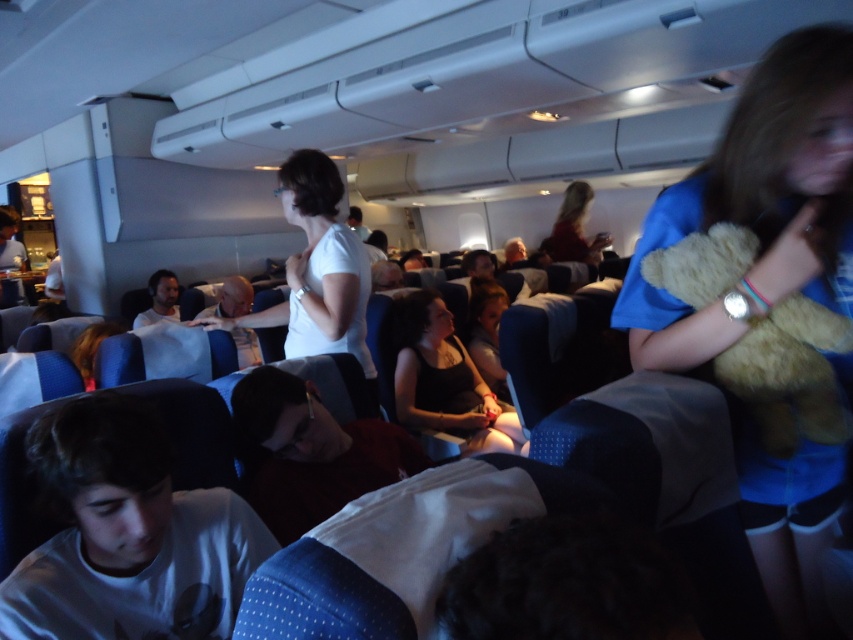
Question: Can you confirm if fluffy beige teddy bear at right is positioned below fuzzy beige teddy bear at right?

Choices:
 (A) yes
 (B) no

Answer: (A)

Question: Does fluffy beige teddy bear at right lie in front of fuzzy beige teddy bear at right?

Choices:
 (A) yes
 (B) no

Answer: (A)

Question: Which object appears closest to the camera in this image?

Choices:
 (A) fuzzy beige teddy bear at right
 (B) fluffy beige teddy bear at right

Answer: (B)

Question: Is fluffy beige teddy bear at right smaller than fuzzy beige teddy bear at right?

Choices:
 (A) no
 (B) yes

Answer: (A)

Question: Which point is farther to the camera?

Choices:
 (A) fuzzy beige teddy bear at right
 (B) fluffy beige teddy bear at right

Answer: (A)